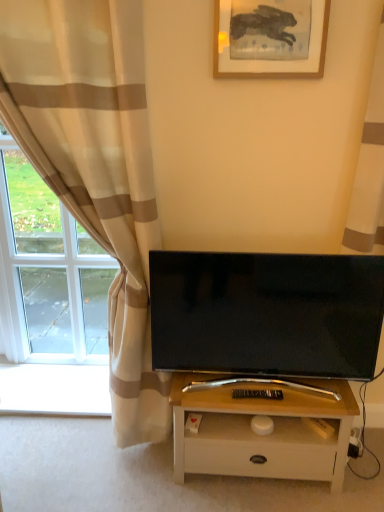
Question: Considering the positions of point (16, 78) and point (281, 392), is point (16, 78) closer or farther from the camera than point (281, 392)?

Choices:
 (A) closer
 (B) farther

Answer: (A)

Question: Is beige striped curtain at left, acting as the 2th curtain starting from the right, wider or thinner than black plastic remote control at center?

Choices:
 (A) wide
 (B) thin

Answer: (A)

Question: Estimate the real-world distances between objects in this image. Which object is farther from the black plastic remote control at center?

Choices:
 (A) wooden picture frame at upper center
 (B) beige striped curtain at upper right, arranged as the 1th curtain when viewed from the right
 (C) black glossy tv at center
 (D) white wood table at center
 (E) beige striped curtain at left, which is counted as the first curtain, starting from the left

Answer: (A)

Question: Which object is the farthest from the black glossy tv at center?

Choices:
 (A) wooden picture frame at upper center
 (B) beige striped curtain at left, which is counted as the first curtain, starting from the left
 (C) black plastic remote control at center
 (D) white wood table at center
 (E) beige striped curtain at upper right, which is the 2th curtain from left to right

Answer: (A)